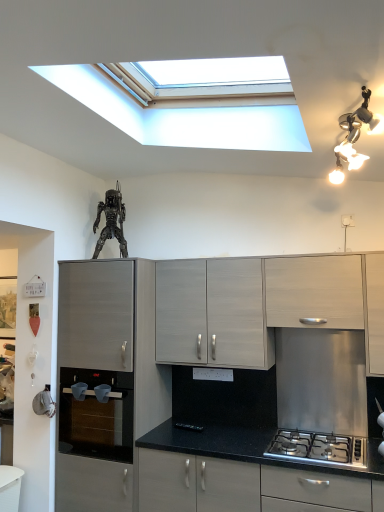
Question: Is point (248, 271) closer or farther from the camera than point (99, 209)?

Choices:
 (A) farther
 (B) closer

Answer: (B)

Question: From the image's perspective, relative to metallic silver figure at upper center, is matte gray cabinet at center, the 2th cabinetry viewed from the left, above or below?

Choices:
 (A) above
 (B) below

Answer: (B)

Question: Considering the real-world distances, which object is closest to the white wood cabinet at upper right, which appears as the fourth cabinetry when viewed from the left?

Choices:
 (A) metallic silver figure at upper center
 (B) matte gray cabinet at center, which appears as the third cabinetry when viewed from the right
 (C) black glass oven at lower left
 (D) silver metallic light fixture at upper right
 (E) satin silver gas stove at lower right

Answer: (B)

Question: Estimate the real-world distances between objects in this image. Which object is farther from the matte black countertop at lower center, placed as the second cabinetry when sorted from right to left?

Choices:
 (A) silver metallic light fixture at upper right
 (B) black glass oven at lower left
 (C) white wood cabinet at upper right, which appears as the fourth cabinetry when viewed from the left
 (D) matte gray cabinet at left, arranged as the 4th cabinetry when viewed from the right
 (E) metallic silver figure at upper center

Answer: (A)